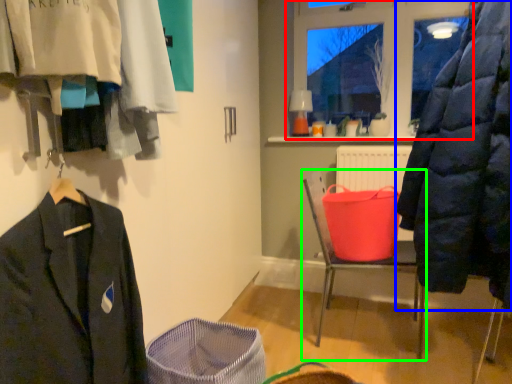
Question: Which is farther away from window (highlighted by a red box)? coat (highlighted by a blue box) or furniture (highlighted by a green box)?

Choices:
 (A) coat
 (B) furniture

Answer: (A)